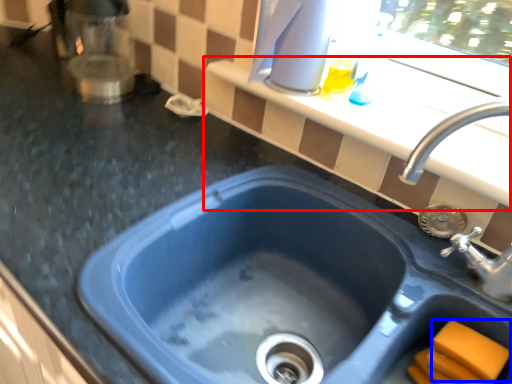
Question: Which object appears farthest to the camera in this image, window sill (highlighted by a red box) or soap (highlighted by a blue box)?

Choices:
 (A) window sill
 (B) soap

Answer: (A)